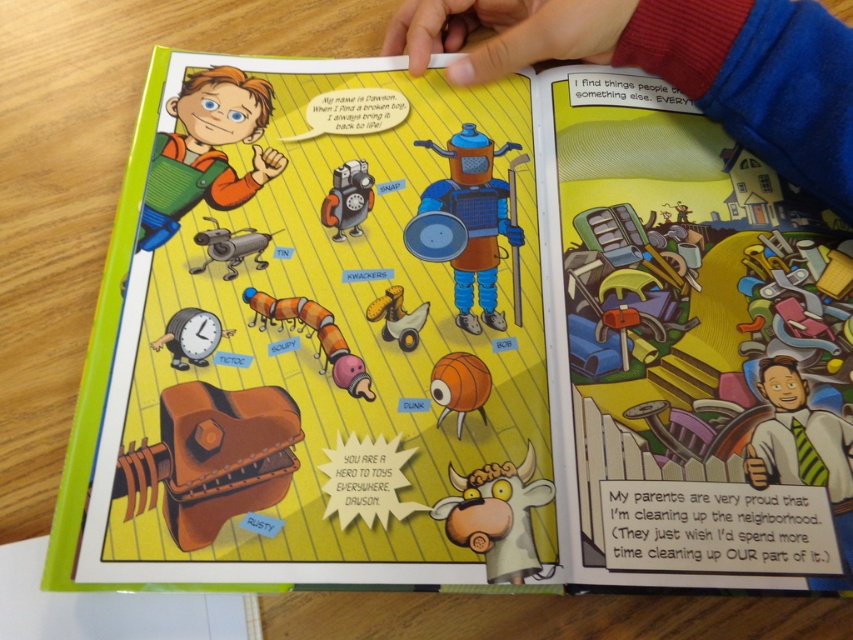
Question: Which of the following is the closest to the observer?

Choices:
 (A) matte plastic robot at center
 (B) green overalls at upper left
 (C) blue fleece sleeve at upper right
 (D) shiny metallic robot at center

Answer: (C)

Question: Is green overalls at upper left closer to camera compared to metallic yellow toy at center?

Choices:
 (A) no
 (B) yes

Answer: (A)

Question: Among these points, which one is farthest from the camera?

Choices:
 (A) (503, 180)
 (B) (724, 48)
 (C) (163, 216)
 (D) (480, 369)

Answer: (A)

Question: Among these points, which one is farthest from the camera?

Choices:
 (A) (824, 80)
 (B) (344, 348)
 (C) (520, 547)
 (D) (212, 349)

Answer: (A)

Question: Can you confirm if rusty metal clock at lower left is wider than metallic yellow toy at center?

Choices:
 (A) yes
 (B) no

Answer: (A)

Question: Is blue plastic robot at center to the right of orange fabric basketball at center from the viewer's perspective?

Choices:
 (A) no
 (B) yes

Answer: (B)